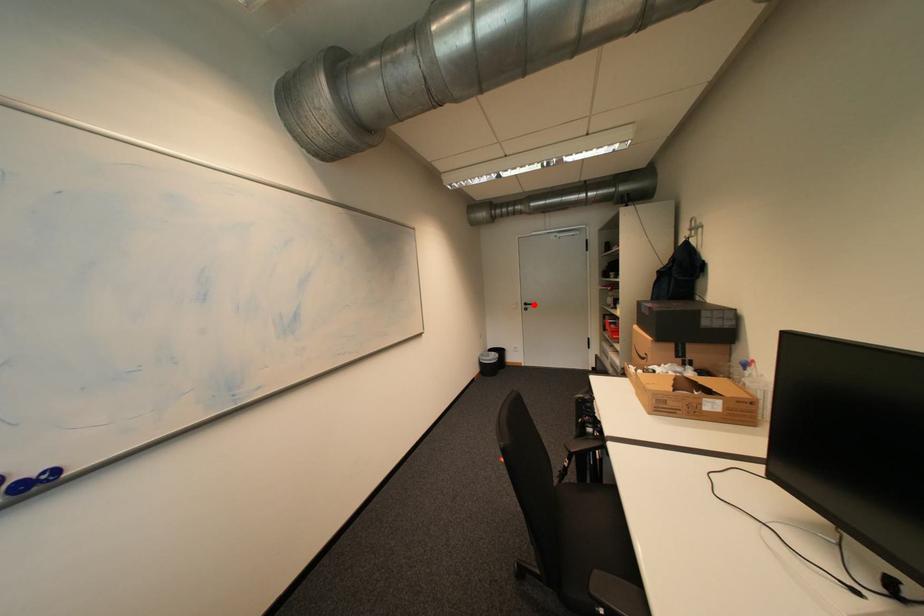
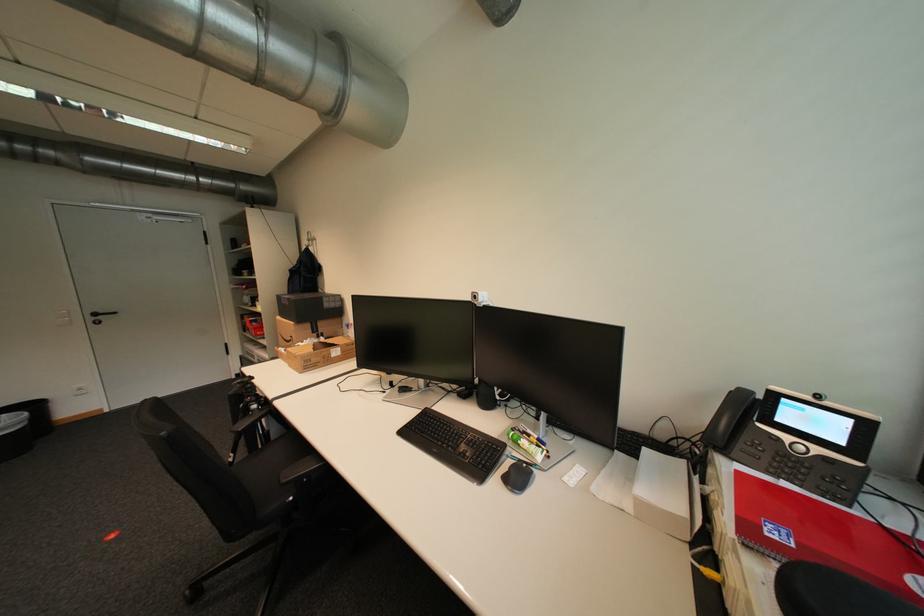
Where in the second image is the point corresponding to the highlighted location from the first image?

(103, 315)